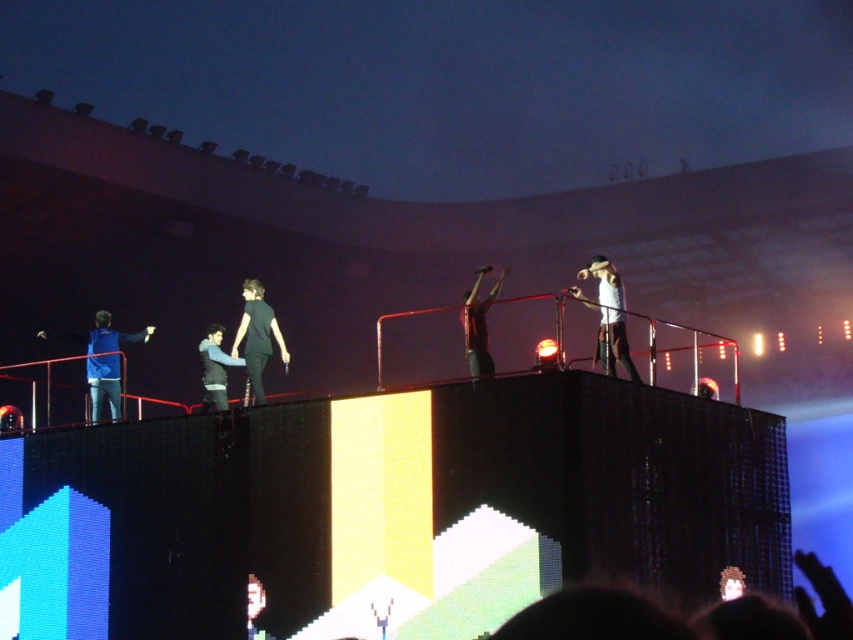
You are a photographer standing at the back of the stadium, and you want to take a closeup photo of the blue fabric jacket at left. The stadium has a rule that you must stay at least 50 meters away from the stage. Can you get a clear closeup shot from your current position?

The blue fabric jacket at left and the viewer are 59.02 meters apart, which is beyond the minimum required distance of 50 meters. However, since you are 59.02 meters away, you might still be able to capture a clear closeup using a zoom lens, as the distance is within a manageable range for professional photography equipment.

You are a photographer at the concert and want to capture a closeup shot of both the black matte shirt at center and the black leather jacket at center in the same frame. Given that your camera has a minimum focus distance of 4 feet, will you be able to achieve this shot?

The black matte shirt at center and the black leather jacket at center are 4.65 feet apart from each other, so yes, you can capture both in the same frame since the distance between them is greater than the camera minimum focus distance of 4 feet.

You are a photographer at the concert. You want to capture a photo where both the white matte shirt at upper right and the black leather jacket at center are visible. Which object should you ensure is in the foreground to avoid being cropped out?

The white matte shirt at upper right has a greater height compared to the black leather jacket at center. To ensure both are visible, position the camera so the taller white matte shirt at upper right is in the foreground, preventing it from being cropped out while the shorter black leather jacket at center remains in view.